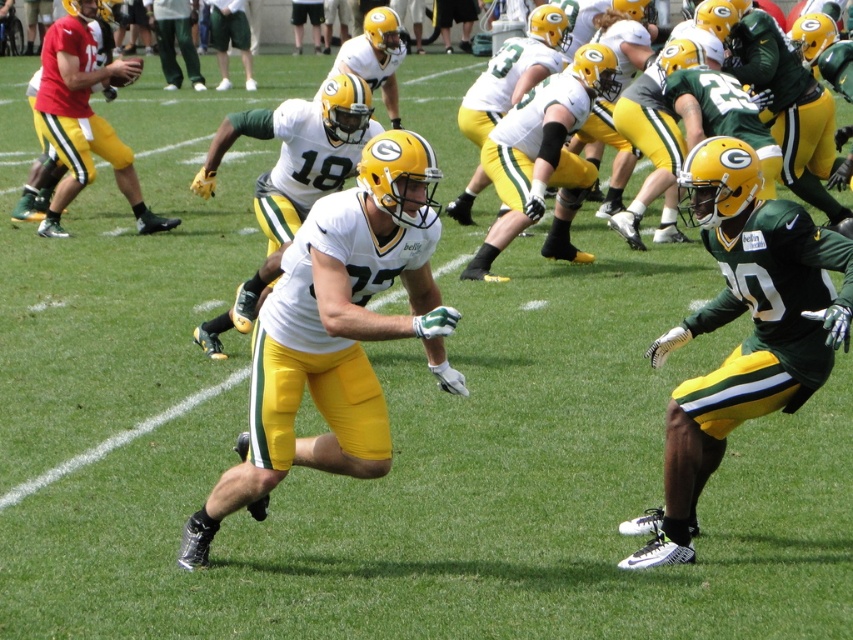
Can you confirm if green matte jersey at center is shorter than matte yellow uniform at left?

Yes.

Locate an element on the screen. green matte jersey at center is located at coordinates [x=746, y=337].

Which is more to the left, matte white jersey at center or white matte jersey at center?

white matte jersey at center is more to the left.

The height and width of the screenshot is (640, 853). What do you see at coordinates (335, 333) in the screenshot?
I see `matte white jersey at center` at bounding box center [335, 333].

Identify the location of matte white jersey at center. The width and height of the screenshot is (853, 640). (335, 333).

Can you confirm if matte white jersey at center is taller than green matte jersey at center?

No, matte white jersey at center is not taller than green matte jersey at center.

From the picture: Does matte white jersey at center appear on the left side of green matte jersey at center?

Yes, matte white jersey at center is to the left of green matte jersey at center.

Does point (415, 333) lie behind point (659, 525)?

No.

Where is `matte white jersey at center`? matte white jersey at center is located at coordinates (335, 333).